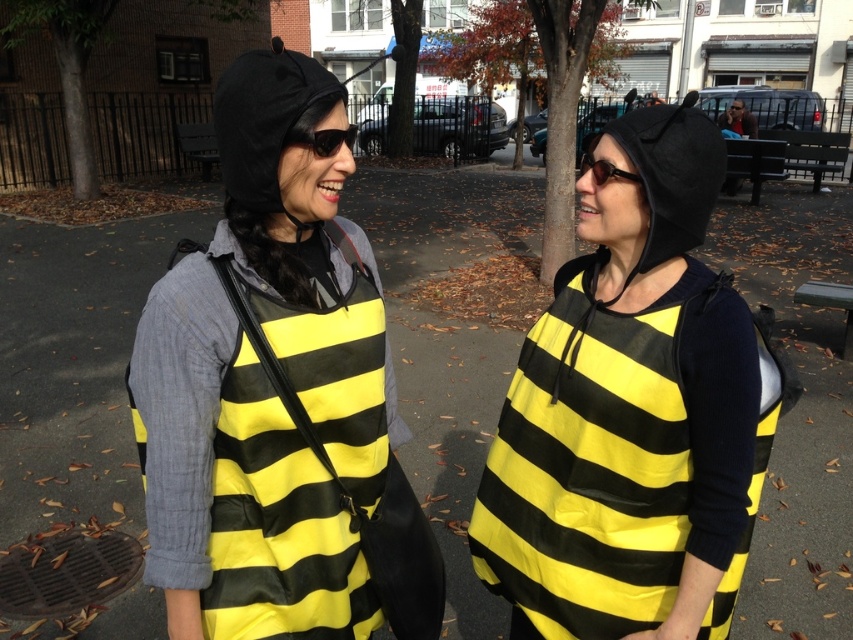
Question: Can you confirm if yellow matte fabric bee costume at center is bigger than black plastic sunglasses at center?

Choices:
 (A) yes
 (B) no

Answer: (A)

Question: Does yellow matte fabric bee costume at center appear on the right side of black plastic sunglasses at center?

Choices:
 (A) no
 (B) yes

Answer: (A)

Question: Which of the following is the closest to the observer?

Choices:
 (A) yellow matte fabric bee costume at center
 (B) yellow fabric bee costume at center
 (C) matte black hoodie at center

Answer: (A)

Question: Which point is farther to the camera?

Choices:
 (A) (729, 621)
 (B) (310, 72)

Answer: (A)

Question: Observing the image, what is the correct spatial positioning of yellow fabric bee costume at center in reference to matte black hoodie at center?

Choices:
 (A) above
 (B) below

Answer: (A)

Question: Which point is farther from the camera taking this photo?

Choices:
 (A) (306, 129)
 (B) (635, 237)
 (C) (349, 596)

Answer: (C)